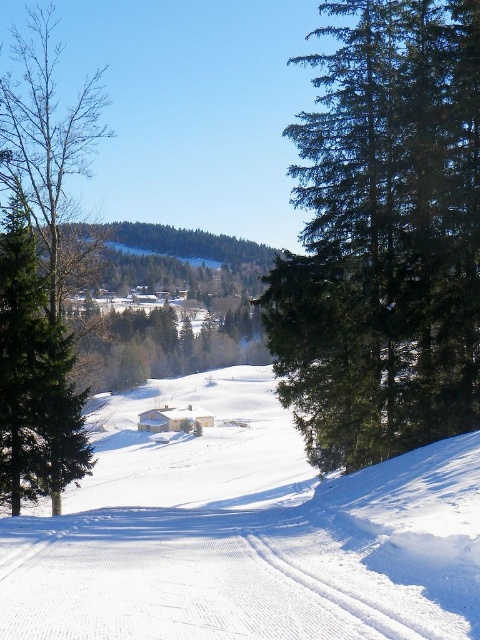
Does white snow ski slope at center have a larger size compared to brown textured tree at left?

Actually, white snow ski slope at center might be smaller than brown textured tree at left.

Can you confirm if white snow ski slope at center is shorter than brown textured tree at left?

Yes.

Describe the element at coordinates (243, 532) in the screenshot. I see `white snow ski slope at center` at that location.

At what (x,y) coordinates should I click in order to perform the action: click on white snow ski slope at center. Please return your answer as a coordinate pair (x, y). Looking at the image, I should click on (243, 532).

Which of these two, green matte tree at right or brown textured tree at left, stands shorter?

green matte tree at right is shorter.

In order to click on green matte tree at right in this screenshot , I will do `click(384, 236)`.

Locate an element on the screen. green matte tree at right is located at coordinates (384, 236).

Does white snow ski slope at center appear on the left side of green matte tree at right?

Yes, white snow ski slope at center is to the left of green matte tree at right.

Is point (169, 596) less distant than point (398, 336)?

That is True.

Is point (391, 600) closer to camera compared to point (377, 288)?

Yes, it is in front of point (377, 288).

Identify the location of white snow ski slope at center. This screenshot has width=480, height=640. (243, 532).